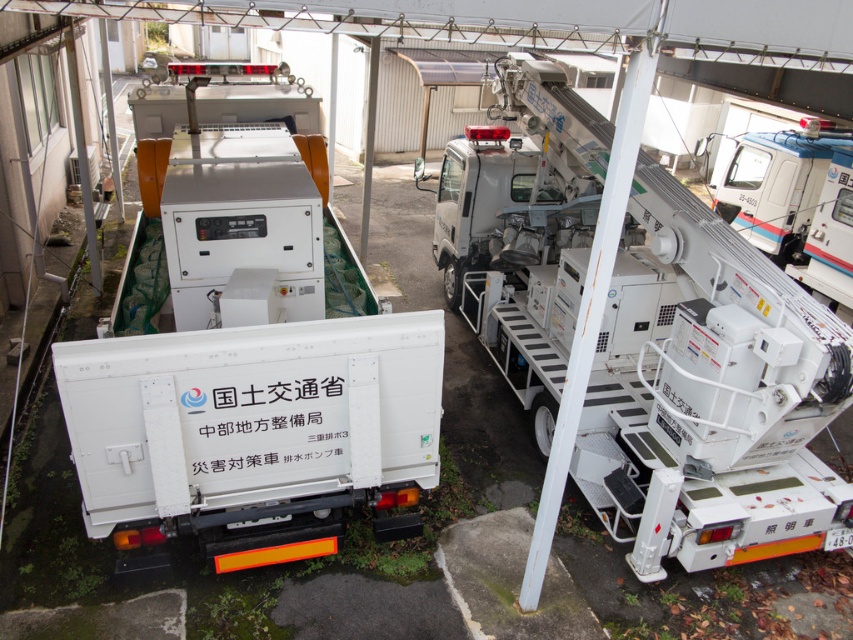
Question: Among these points, which one is farthest from the camera?

Choices:
 (A) (349, 403)
 (B) (642, 211)
 (C) (786, 241)

Answer: (C)

Question: Which point appears closest to the camera in this image?

Choices:
 (A) (279, 508)
 (B) (845, 308)

Answer: (A)

Question: Which object appears closest to the camera in this image?

Choices:
 (A) white plastic truck at upper right
 (B) white metallic truck at right

Answer: (B)

Question: Is white matte truck at center behind white plastic truck at upper right?

Choices:
 (A) yes
 (B) no

Answer: (B)

Question: Can you confirm if white matte truck at center is wider than white metallic truck at right?

Choices:
 (A) yes
 (B) no

Answer: (B)

Question: Does white matte truck at center appear under white metallic truck at right?

Choices:
 (A) no
 (B) yes

Answer: (A)